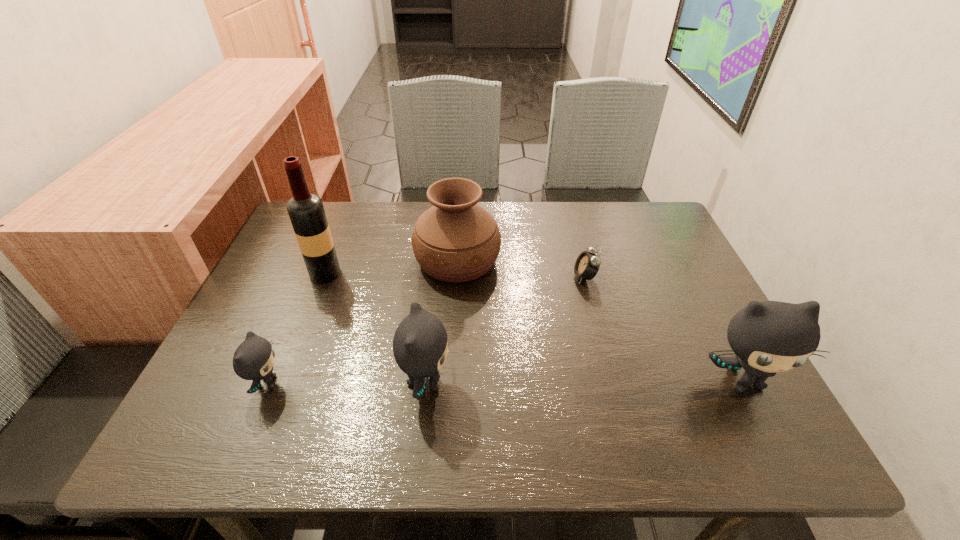
Where is `object situated at the near left corner`? Image resolution: width=960 pixels, height=540 pixels. object situated at the near left corner is located at coordinates click(254, 358).

Where is `object at the near right corner`? The height and width of the screenshot is (540, 960). object at the near right corner is located at coordinates (767, 337).

In the image, there is a desktop. At what (x,y) coordinates should I click in order to perform the action: click on vacant space at the far edge. Please return your answer as a coordinate pair (x, y). This screenshot has height=540, width=960. Looking at the image, I should click on (408, 232).

Locate an element on the screen. Image resolution: width=960 pixels, height=540 pixels. free point at the near edge is located at coordinates (454, 393).

Image resolution: width=960 pixels, height=540 pixels. What are the coordinates of `blank space at the left edge` in the screenshot? It's located at (278, 259).

Find the location of a particular element. The width and height of the screenshot is (960, 540). vacant space at the right edge of the desktop is located at coordinates (659, 256).

The height and width of the screenshot is (540, 960). In order to click on free space at the far left corner of the desktop in this screenshot , I will do `click(338, 212)`.

The image size is (960, 540). What are the coordinates of `vacant space at the near left corner of the desktop` in the screenshot? It's located at (277, 379).

You are a GUI agent. You are given a task and a screenshot of the screen. Output one action in this format:
    pyautogui.click(x=<x>, y=<y>)
    Task: Click on the free location at the far right corner
    
    Given the screenshot: What is the action you would take?
    click(x=637, y=213)

I want to click on empty location between the urn and the rightmost object, so click(x=600, y=320).